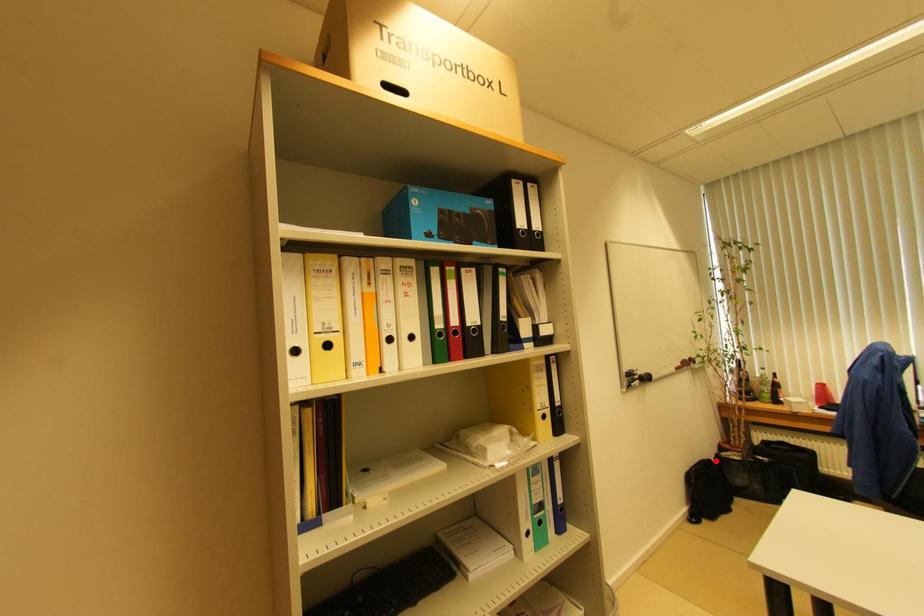
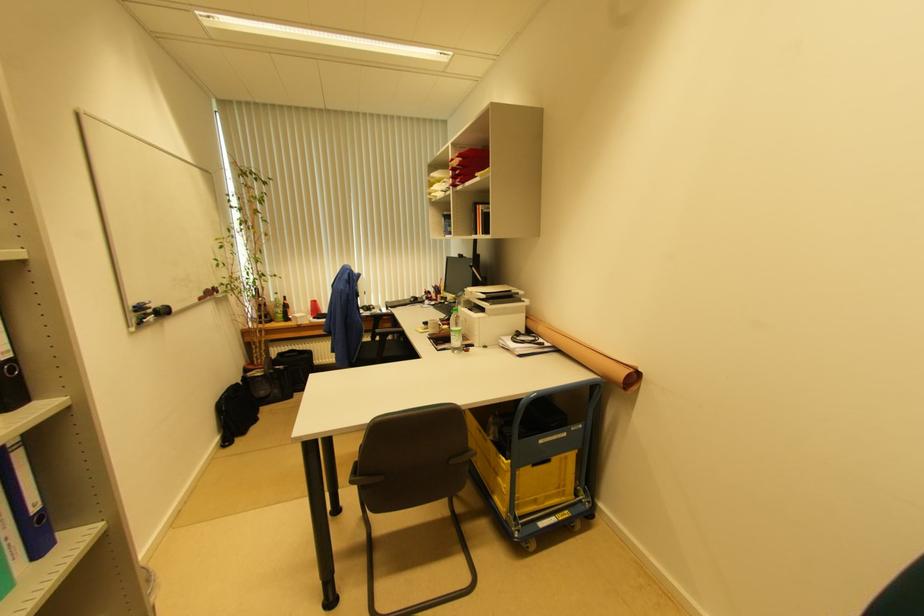
Question: A red point is marked in image1. In image2, is the corresponding 3D point closer to the camera or farther? Reply with the corresponding letter.

Choices:
 (A) The corresponding 3D point is closer.
 (B) The corresponding 3D point is farther.

Answer: (A)